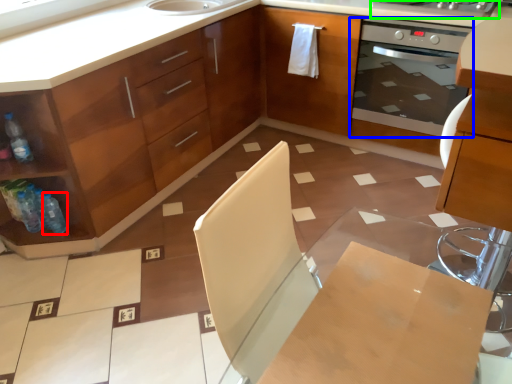
Question: Which object is the closest to the bottle (highlighted by a red box)? Choose among these: home appliance (highlighted by a blue box) or kitchen appliance (highlighted by a green box).

Choices:
 (A) home appliance
 (B) kitchen appliance

Answer: (A)